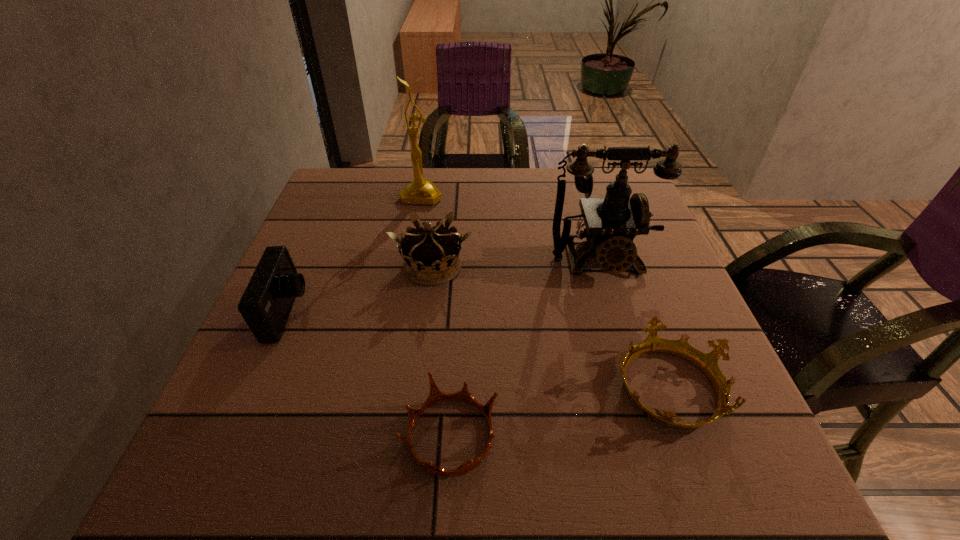
You are a GUI agent. You are given a task and a screenshot of the screen. Output one action in this format:
    pyautogui.click(x=<x>, y=<y>)
    Task: Click on the farthest object
    The image size is (960, 540).
    Given the screenshot: What is the action you would take?
    pyautogui.click(x=420, y=191)

I want to click on telephone, so click(x=612, y=223).

Find the location of a particular element. The image size is (960, 540). the tallest crown is located at coordinates (431, 255).

The height and width of the screenshot is (540, 960). I want to click on the leftmost object, so click(x=267, y=301).

I want to click on the rightmost crown, so click(x=707, y=362).

At what (x,y) coordinates should I click in order to perform the action: click on vacant space located 0.310m on the front-facing side of the farthest object. Please return your answer as a coordinate pair (x, y). Looking at the image, I should click on (405, 287).

Locate an element on the screen. vacant point located 0.190m on the rotary dial of the telephone is located at coordinates (629, 357).

Find the location of a particular element. vacant space located on the left of the tallest crown is located at coordinates (322, 267).

At what (x,y) coordinates should I click in order to perform the action: click on free location located on the front-facing side of the leftmost object. Please return your answer as a coordinate pair (x, y). The height and width of the screenshot is (540, 960). Looking at the image, I should click on (404, 313).

Find the location of a particular element. This screenshot has height=540, width=960. free spot located on the back of the rightmost crown is located at coordinates (615, 241).